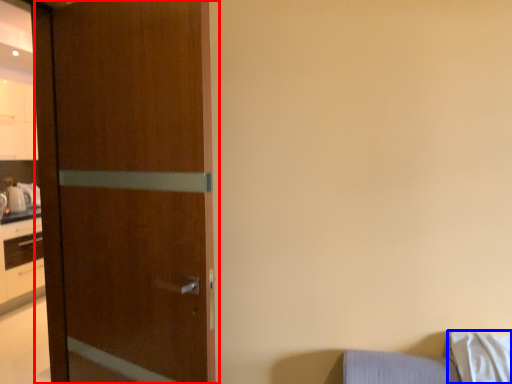
Question: Which object appears farthest to the camera in this image, door (highlighted by a red box) or pillow (highlighted by a blue box)?

Choices:
 (A) door
 (B) pillow

Answer: (B)